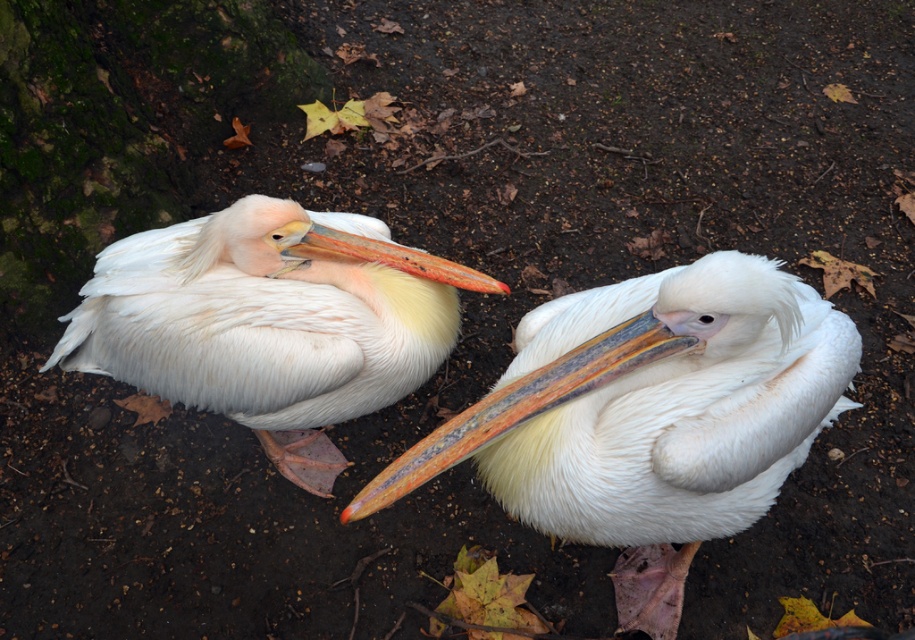
You are a photographer trying to capture the white feathered pelican at center in the image. The camera is set to focus on the point at coordinates point (650, 406). Will this point be on the pelican?

Yes, the point (650, 406) indicates the white feathered pelican at center, so the focus will be on the pelican.

You are standing at the point with coordinates point (239,232) and want to walk towards the tree trunk on the left. Is the point (639,353) blocking your path?

Point (639,353) is in front of point (239,232), so yes, the point (639,353) is blocking your path to the tree trunk on the left.

You are a photographer trying to capture the white feathered pelican at center. You have a camera with a zoom lens that can focus on objects within a 0.5 unit radius. If the image coordinate system has the origin at the bottom left corner, what is the minimum zoom level required to ensure the pelican is within the focus area?

The white feathered pelican at center is located at coordinate point [650,406]. To ensure it stays within the focus area of 0.5 unit radius, the minimum zoom level should be set so that the focus area covers this coordinate.